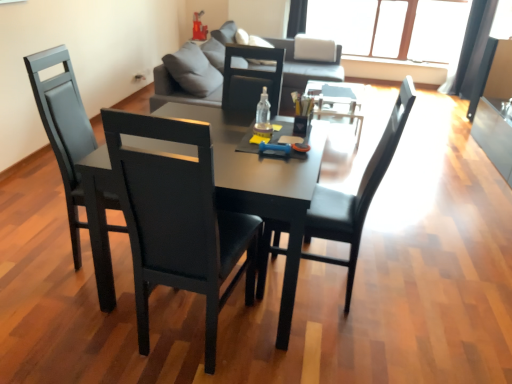
Question: From a real-world perspective, is matte black table at center located beneath matte black chair at left, the third chair viewed from the right?

Choices:
 (A) no
 (B) yes

Answer: (B)

Question: Can you confirm if matte black table at center is shorter than matte black chair at left, placed as the 1th chair when sorted from left to right?

Choices:
 (A) yes
 (B) no

Answer: (A)

Question: Does matte black table at center touch matte black chair at left, the third chair viewed from the right?

Choices:
 (A) no
 (B) yes

Answer: (A)

Question: Is matte black table at center aimed at matte black chair at left, the third chair viewed from the right?

Choices:
 (A) no
 (B) yes

Answer: (A)

Question: Can you confirm if matte black table at center is taller than matte black chair at left, the third chair viewed from the right?

Choices:
 (A) yes
 (B) no

Answer: (B)

Question: From a real-world perspective, is matte black table at center positioned over matte black chair at left, placed as the 1th chair when sorted from left to right, based on gravity?

Choices:
 (A) yes
 (B) no

Answer: (B)

Question: Considering the relative sizes of black leather chair at left, which is the second chair from right to left, and matte black chair at left, the third chair viewed from the right, in the image provided, is black leather chair at left, which is the second chair from right to left, taller than matte black chair at left, the third chair viewed from the right,?

Choices:
 (A) yes
 (B) no

Answer: (A)

Question: From a real-world perspective, is black leather chair at left, which is the second chair from right to left, over matte black chair at left, placed as the 1th chair when sorted from left to right?

Choices:
 (A) no
 (B) yes

Answer: (B)

Question: Is black leather chair at left, which is the second chair from right to left, far away from matte black chair at left, placed as the 1th chair when sorted from left to right?

Choices:
 (A) no
 (B) yes

Answer: (A)

Question: Is black leather chair at left, which is the 2th chair from left to right, further to the viewer compared to matte black chair at left, placed as the 1th chair when sorted from left to right?

Choices:
 (A) yes
 (B) no

Answer: (B)

Question: Is black leather chair at left, which is the second chair from right to left, positioned with its back to matte black chair at left, the third chair viewed from the right?

Choices:
 (A) yes
 (B) no

Answer: (B)

Question: Considering the relative sizes of black leather chair at left, which is the 2th chair from left to right, and matte black chair at left, the third chair viewed from the right, in the image provided, is black leather chair at left, which is the 2th chair from left to right, thinner than matte black chair at left, the third chair viewed from the right,?

Choices:
 (A) no
 (B) yes

Answer: (A)

Question: Does black leather chair at left, which is the 2th chair from left to right, come behind black leather chair at center, the 1th chair from the right?

Choices:
 (A) no
 (B) yes

Answer: (A)